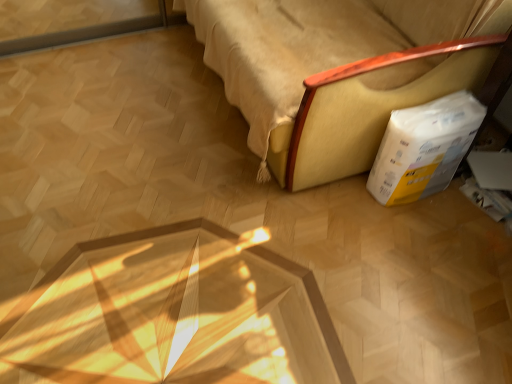
At what (x,y) coordinates should I click in order to perform the action: click on free spot in front of white/yellow cardboard box at lower right. Please return your answer as a coordinate pair (x, y). This screenshot has height=384, width=512. Looking at the image, I should click on (420, 231).